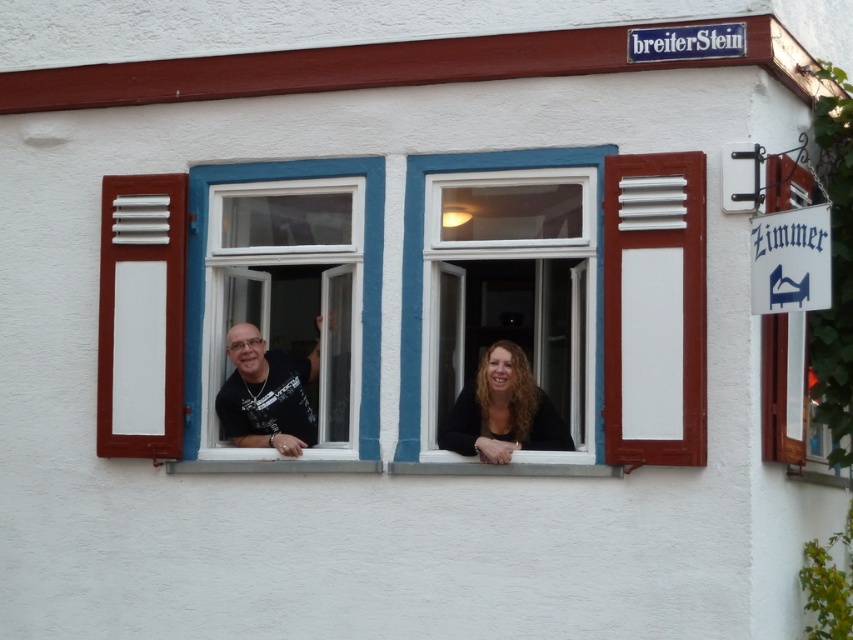
Which is below, black matte couple at center or dark brown hair at center?

dark brown hair at center

Does point (274, 358) come behind point (503, 408)?

Yes, point (274, 358) is behind point (503, 408).

Which is in front, point (245, 438) or point (532, 397)?

Point (532, 397) is more forward.

The height and width of the screenshot is (640, 853). I want to click on black matte couple at center, so click(264, 394).

In the scene shown: Can you confirm if white painted wood at right is positioned below white painted wood at left?

No, white painted wood at right is not below white painted wood at left.

Is point (679, 268) positioned behind point (148, 314)?

That is False.

You are a GUI agent. You are given a task and a screenshot of the screen. Output one action in this format:
    pyautogui.click(x=<x>, y=<y>)
    Task: Click on the white painted wood at right
    
    Given the screenshot: What is the action you would take?
    pyautogui.click(x=654, y=308)

Measure the distance between white painted wood at left and camera.

white painted wood at left is 11.17 meters away from camera.

Which is in front, point (144, 436) or point (379, 272)?

Positioned in front is point (379, 272).

This screenshot has width=853, height=640. What are the coordinates of `white painted wood at left` in the screenshot? It's located at (141, 316).